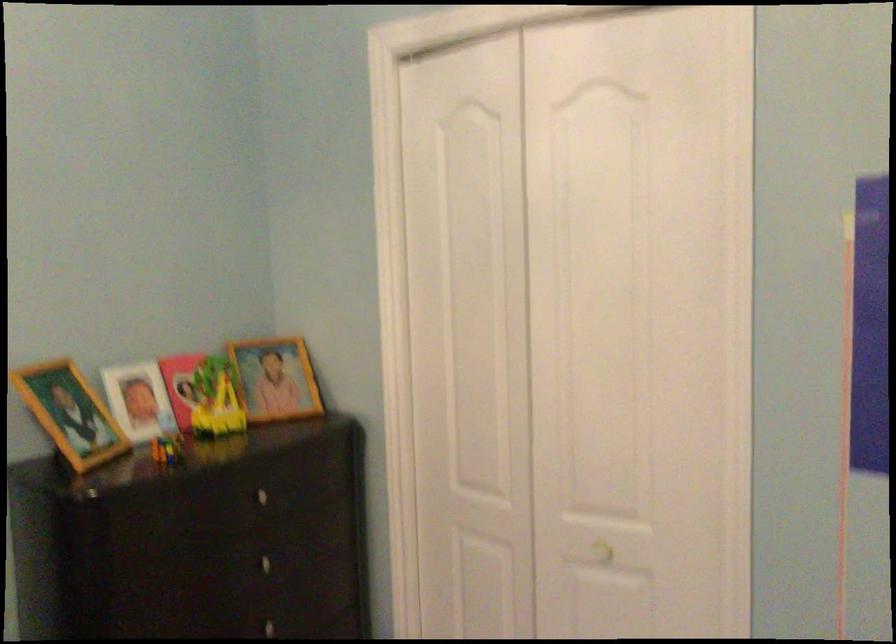
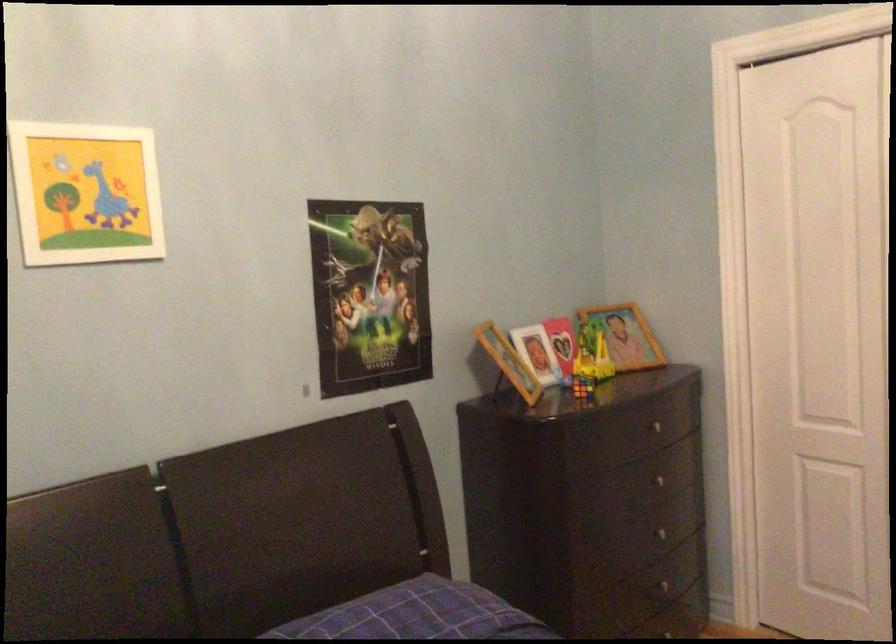
Find the pixel in the second image that matches point (256, 560) in the first image.

(656, 480)